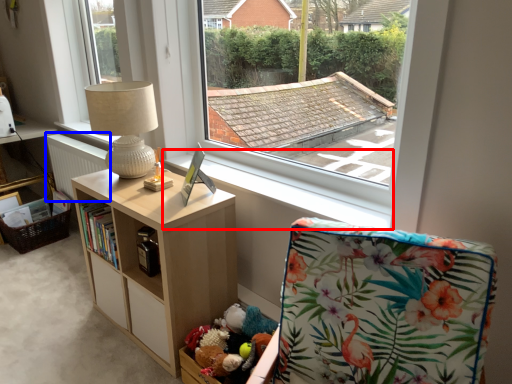
Question: Which object is further to the camera taking this photo, window sill (highlighted by a red box) or radiator (highlighted by a blue box)?

Choices:
 (A) window sill
 (B) radiator

Answer: (B)